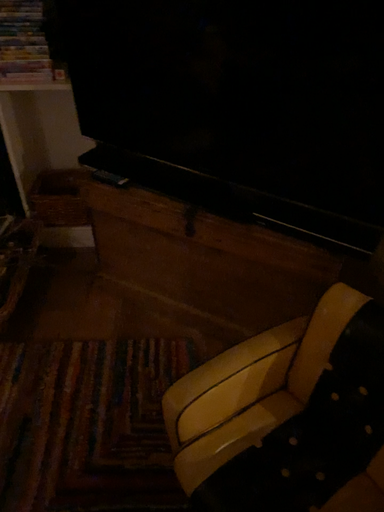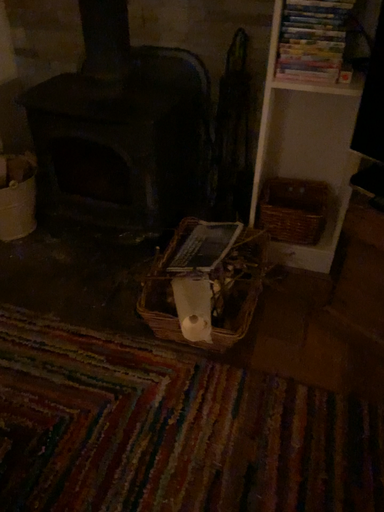
Question: How did the camera likely rotate when shooting the video?

Choices:
 (A) rotated right
 (B) rotated left

Answer: (B)